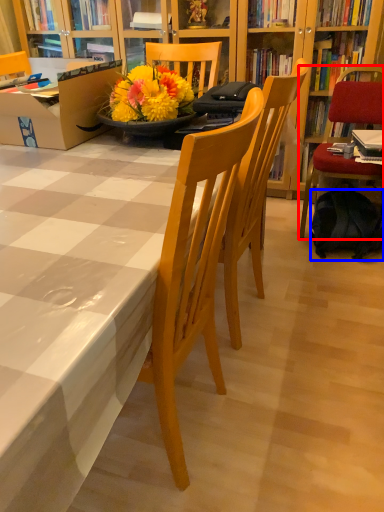
Question: Among these objects, which one is nearest to the camera, chair (highlighted by a red box) or backpack (highlighted by a blue box)?

Choices:
 (A) chair
 (B) backpack

Answer: (A)